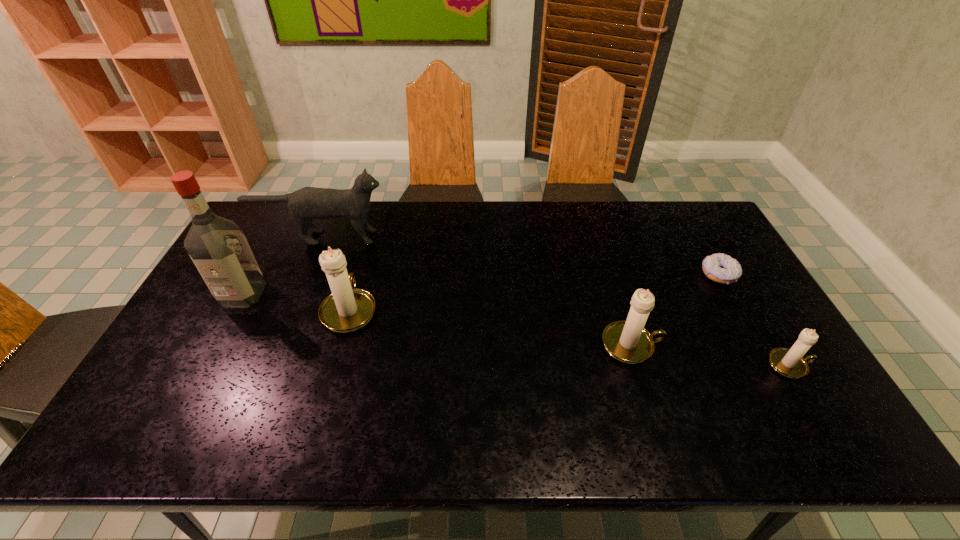
Where is `the leftmost candle holder`? The height and width of the screenshot is (540, 960). the leftmost candle holder is located at coordinates (347, 309).

Find the location of a particular element. This screenshot has height=540, width=960. the fourth tallest object is located at coordinates (628, 341).

This screenshot has height=540, width=960. In order to click on the third object from right to left in this screenshot , I will do click(x=628, y=341).

You are a GUI agent. You are given a task and a screenshot of the screen. Output one action in this format:
    pyautogui.click(x=<x>, y=<y>)
    Task: Click on the fifth tallest object
    This screenshot has width=960, height=540.
    Given the screenshot: What is the action you would take?
    pyautogui.click(x=788, y=362)

At what (x,y) coordinates should I click in order to perform the action: click on the shortest candle holder. Please return your answer as a coordinate pair (x, y). This screenshot has width=960, height=540. Looking at the image, I should click on (788, 362).

This screenshot has height=540, width=960. Identify the location of the farthest object. (308, 203).

Locate an element on the screen. The width and height of the screenshot is (960, 540). doughnut is located at coordinates (721, 268).

Where is `liquor`? liquor is located at coordinates (217, 246).

The width and height of the screenshot is (960, 540). What are the coordinates of `free space located 0.300m on the handle side of the leftmost candle holder` in the screenshot? It's located at (373, 226).

Where is `vacant area situated 0.300m on the handle side of the leftmost candle holder`? This screenshot has width=960, height=540. vacant area situated 0.300m on the handle side of the leftmost candle holder is located at coordinates (373, 226).